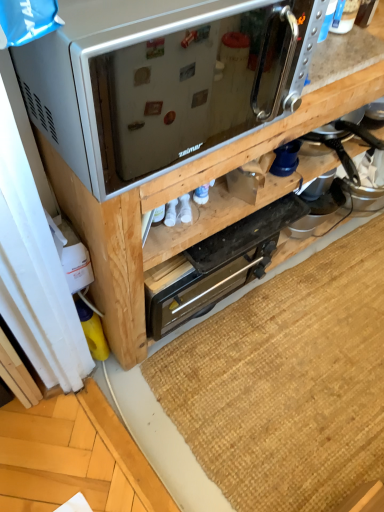
Where is `vacant space underneath brown woven mat at lower center (from a real-world perspective)`? vacant space underneath brown woven mat at lower center (from a real-world perspective) is located at coordinates [308, 362].